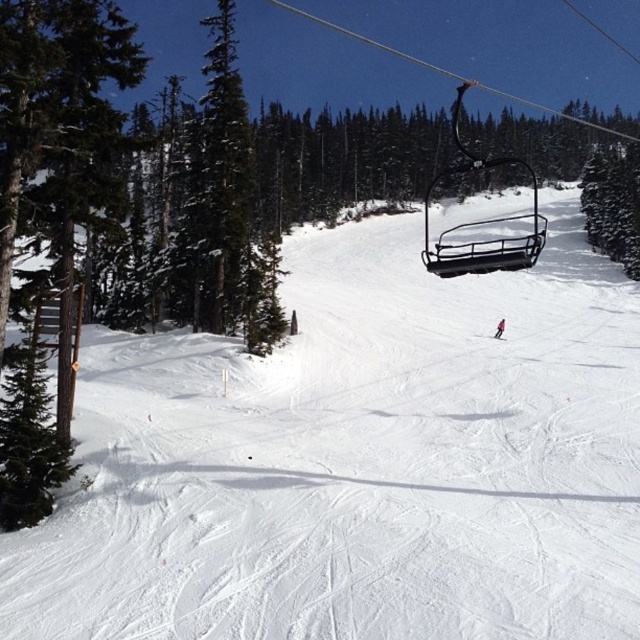
Does white snow ski slope at center come behind green snow-covered tree at right?

No, it is not.

Who is shorter, white snow ski slope at center or green snow-covered tree at right?

With less height is white snow ski slope at center.

Does point (392, 540) come behind point (628, 272)?

No, (392, 540) is closer to viewer.

Find the location of `white snow ski slope at center`. white snow ski slope at center is located at coordinates (358, 461).

Does black metal ski lift at upper center lie behind white matte ski at center?

No, it is not.

Is black metal ski lift at upper center below white matte ski at center?

No, black metal ski lift at upper center is not below white matte ski at center.

Locate an element on the screen. black metal ski lift at upper center is located at coordinates (481, 221).

You are a GUI agent. You are given a task and a screenshot of the screen. Output one action in this format:
    pyautogui.click(x=<x>, y=<y>)
    Task: Click on the black metal ski lift at upper center
    The width and height of the screenshot is (640, 640).
    Given the screenshot: What is the action you would take?
    pyautogui.click(x=481, y=221)

Is green snow-covered tree at right further to camera compared to pink matte ski at center?

Yes, it is.

Can you confirm if green snow-covered tree at right is positioned to the right of pink matte ski at center?

Correct, you'll find green snow-covered tree at right to the right of pink matte ski at center.

What do you see at coordinates (612, 204) in the screenshot? I see `green snow-covered tree at right` at bounding box center [612, 204].

Identify the location of green snow-covered tree at right. (612, 204).